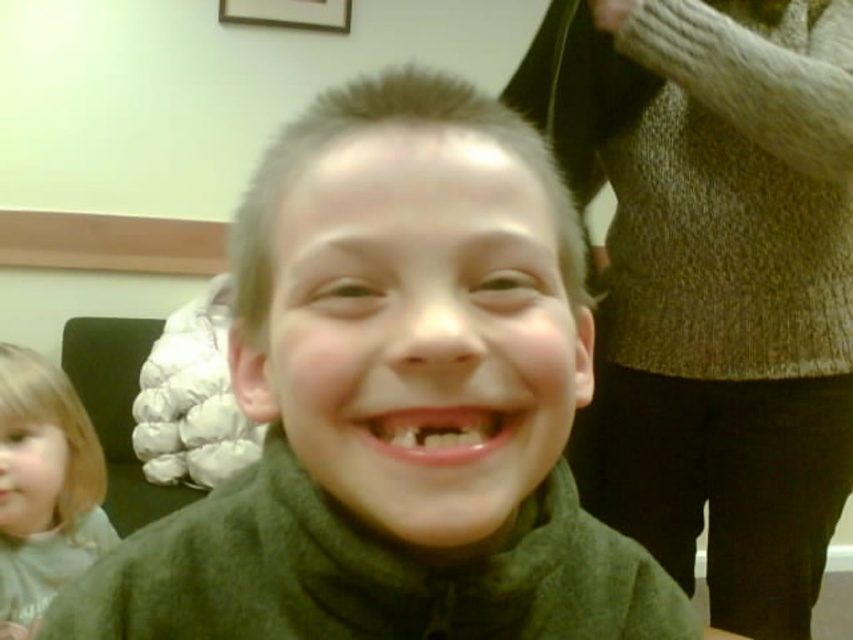
Question: Among these points, which one is farthest from the camera?

Choices:
 (A) (289, 333)
 (B) (529, 131)
 (C) (728, 28)

Answer: (C)

Question: Among these objects, which one is farthest from the camera?

Choices:
 (A) green matte jacket at center
 (B) short blonde hair at center
 (C) green knitted sweater at center

Answer: (C)

Question: Can you confirm if light brown hair at lower left is smaller than short blonde hair at center?

Choices:
 (A) yes
 (B) no

Answer: (B)

Question: Can you confirm if green matte jacket at center is thinner than green knitted sweater at center?

Choices:
 (A) yes
 (B) no

Answer: (A)

Question: Can you confirm if green matte jacket at center is positioned to the left of green knitted sweater at center?

Choices:
 (A) no
 (B) yes

Answer: (B)

Question: Which object is the farthest from the short blonde hair at center?

Choices:
 (A) light brown hair at lower left
 (B) green knitted sweater at center

Answer: (A)